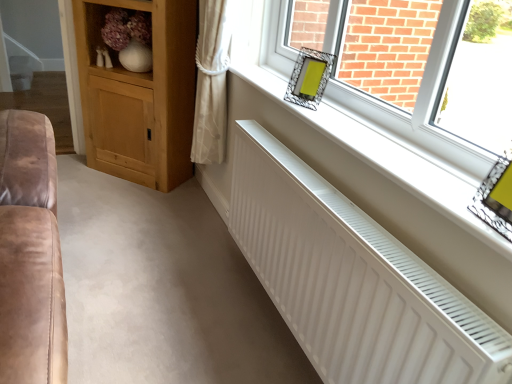
At what (x,y) coordinates should I click in order to perform the action: click on vacant area situated to the left side of metallic silver frame at upper right, which is counted as the first picture frame, starting from the front. Please return your answer as a coordinate pair (x, y). This screenshot has width=512, height=384. Looking at the image, I should click on (457, 210).